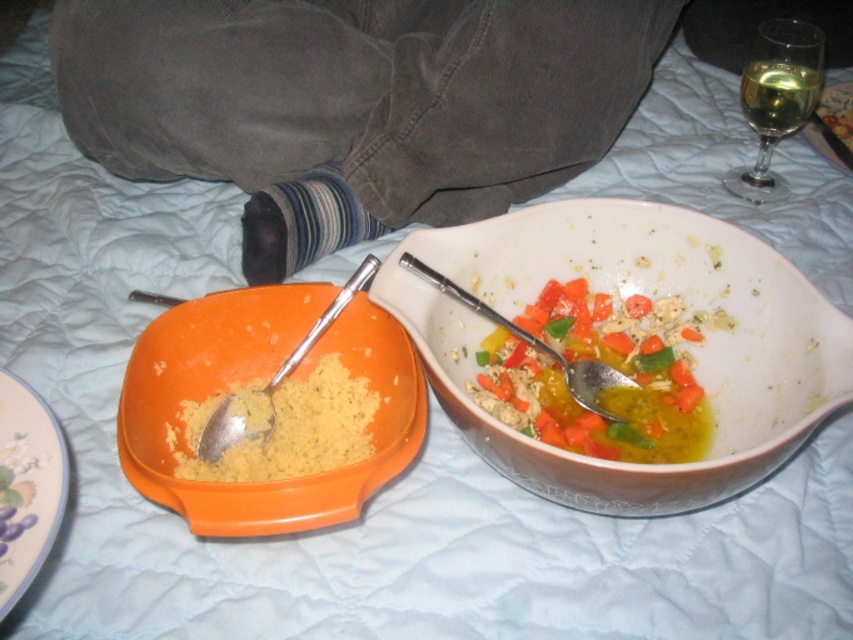
You are setting up a table for two guests. You have a white matte bowl at center and a gold metallic plate at upper right. Which item should you place farther from the edge of the table to prevent it from falling off if the table is only 1 meter wide?

The white matte bowl at center has a larger width than the gold metallic plate at upper right, so it should be placed farther from the edge of the table to prevent it from falling off.